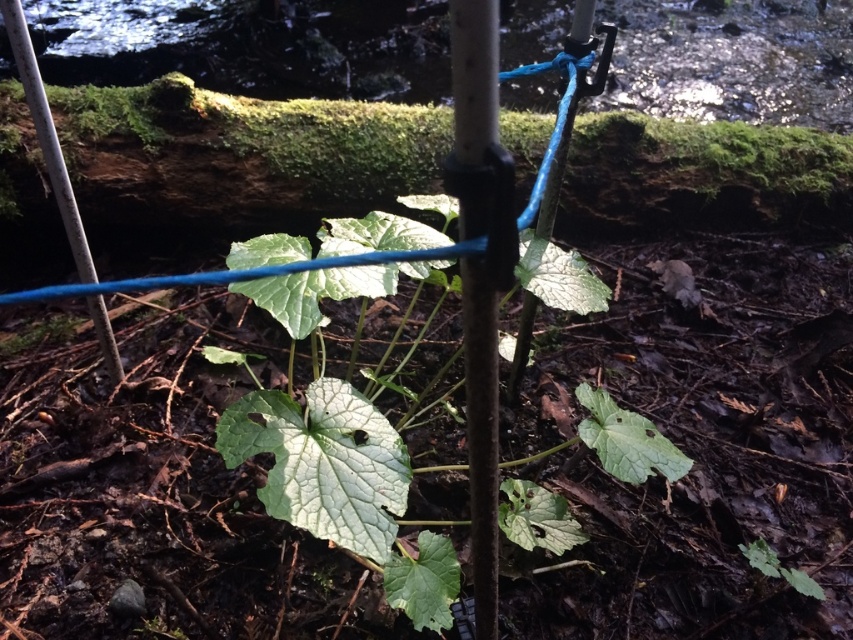
You are a gardener who needs to choose between the smooth white pole at center and the white matte pole at left to support a heavy climbing plant. Which pole should you choose based on their sizes?

The white matte pole at left is larger in size compared to the smooth white pole at center, so the gardener should choose the white matte pole at left to support the heavy climbing plant.

Consider the image. You are a botanist studying the green matte leafy plant at center. To ensure proper growth, you need to place a nutrient dispenser exactly 0.3 meters to the northeast of the plant. Given the coordinates of the plant are at point 0.755, 0.406, where should the dispenser be placed?

The nutrient dispenser should be placed at coordinates (x=345, y=483) plus 0.3 meters northeast. However, without knowing the scale of the coordinate system, precise calculation isn

You are a gardener who wants to ensure the green matte leafy plant at center is visible from a distance. Since the white matte pole at left is supporting it, how does the height of the plant compare to the pole?

The green matte leafy plant at center is shorter than the white matte pole at left, so the pole is taller and may help the plant stand upright but does not obscure its visibility from a distance.